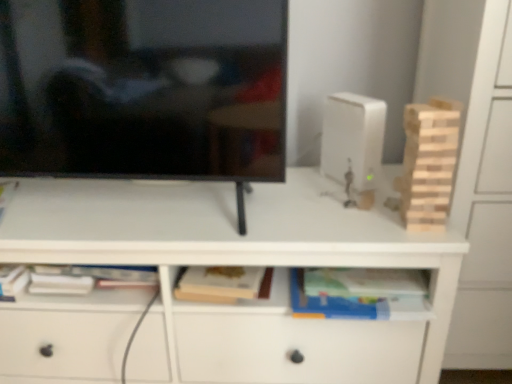
Find the location of a particular element. free space between black glossy television at upper left and light wood block tower at right is located at coordinates (339, 220).